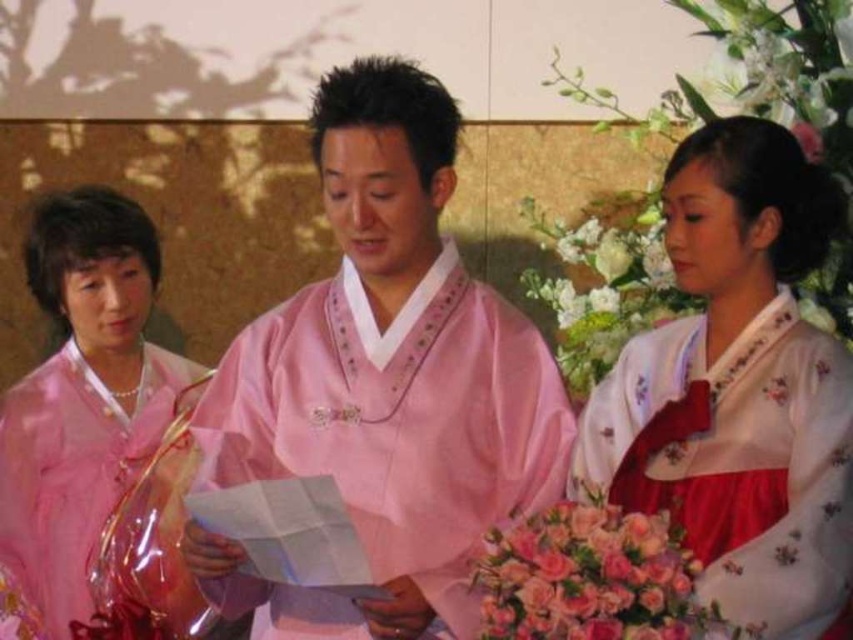
How far apart are white satin hanbok at right and satin pink hanbok at left?

The distance of white satin hanbok at right from satin pink hanbok at left is 1.48 meters.

In the scene shown: Which of these two, white satin hanbok at right or satin pink hanbok at left, stands shorter?

white satin hanbok at right

Image resolution: width=853 pixels, height=640 pixels. Identify the location of white satin hanbok at right. (740, 388).

In the scene shown: Can you confirm if white satin hanbok at right is positioned above pink floral bouquet at lower right?

Indeed, white satin hanbok at right is positioned over pink floral bouquet at lower right.

From the picture: Is white satin hanbok at right wider than pink floral bouquet at lower right?

Yes, white satin hanbok at right is wider than pink floral bouquet at lower right.

Is point (689, 442) farther from camera compared to point (675, 548)?

That is True.

Where is `white satin hanbok at right`? This screenshot has height=640, width=853. white satin hanbok at right is located at coordinates (740, 388).

Is pink satin kimono at center bigger than pink floral bouquet at lower right?

Correct, pink satin kimono at center is larger in size than pink floral bouquet at lower right.

In the scene shown: Is the position of pink satin kimono at center more distant than that of pink floral bouquet at lower right?

Yes, it is behind pink floral bouquet at lower right.

This screenshot has height=640, width=853. What do you see at coordinates (386, 380) in the screenshot? I see `pink satin kimono at center` at bounding box center [386, 380].

This screenshot has width=853, height=640. I want to click on pink satin kimono at center, so click(386, 380).